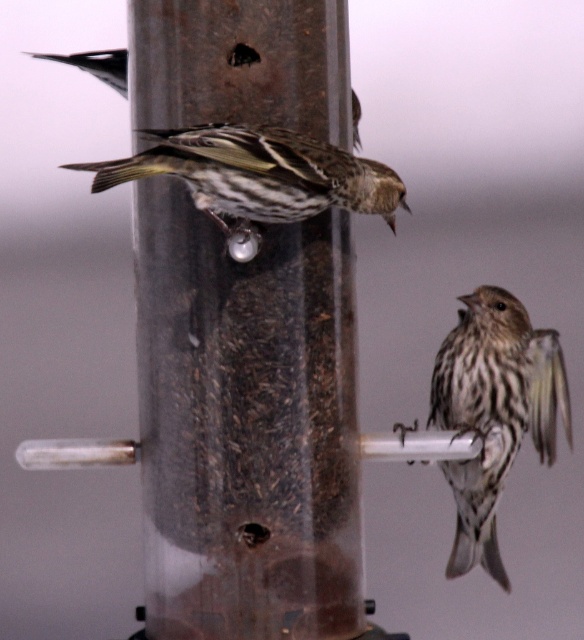
You are a birder observing the bird feeder. You notice two sparrows, the brown striped sparrow at center and the dark brown speckled sparrow at upper left. Which one is bigger?

The brown striped sparrow at center is larger in size compared to the dark brown speckled sparrow at upper left.